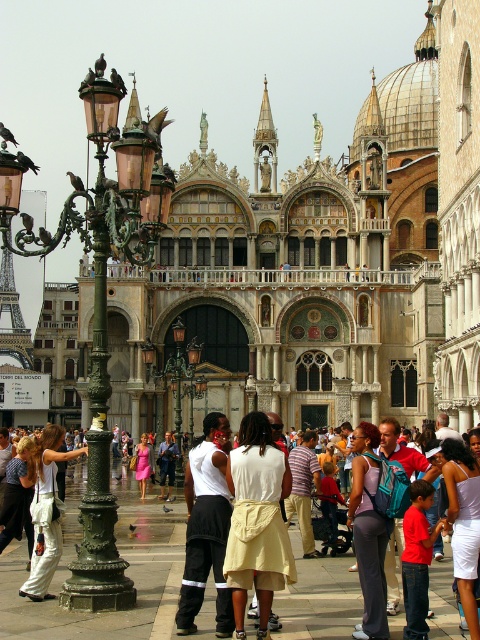
Is green ornate lamp post at center behind white cotton shirt at center?

Yes, it is.

Who is higher up, green ornate lamp post at center or white cotton shirt at center?

green ornate lamp post at center is higher up.

Which is in front, point (175, 406) or point (160, 477)?

Point (160, 477) is more forward.

At what (x,y) coordinates should I click in order to perform the action: click on green ornate lamp post at center. Please return your answer as a coordinate pair (x, y). This screenshot has width=480, height=640. Looking at the image, I should click on (179, 372).

The height and width of the screenshot is (640, 480). Identify the location of green patinated metal streetlight at left. (104, 305).

Is green patinated metal streetlight at left bigger than white cotton skirt at center?

Yes.

Find the location of a particular element. green patinated metal streetlight at left is located at coordinates (104, 305).

Where is `green patinated metal streetlight at left`? The height and width of the screenshot is (640, 480). green patinated metal streetlight at left is located at coordinates (104, 305).

Which is above, striped cotton shirt at center or pink satin dress at center?

striped cotton shirt at center

Is point (302, 449) positioned in front of point (152, 456)?

Yes, it is in front of point (152, 456).

Who is more distant from viewer, (x=297, y=445) or (x=137, y=465)?

Positioned behind is point (x=297, y=445).

Image resolution: width=480 pixels, height=640 pixels. Identify the location of striped cotton shirt at center. (303, 490).